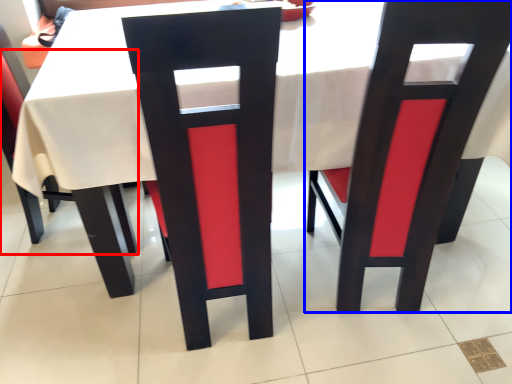
Question: Which object is closer to the camera taking this photo, chair (highlighted by a red box) or chair (highlighted by a blue box)?

Choices:
 (A) chair
 (B) chair

Answer: (B)